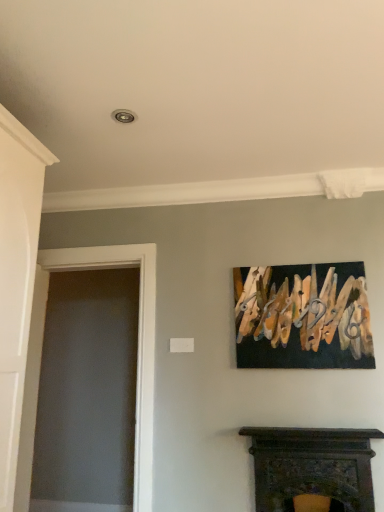
What do you see at coordinates (303, 317) in the screenshot? The height and width of the screenshot is (512, 384). I see `wooden clothespins at upper right` at bounding box center [303, 317].

Find the location of `dark wood fireplace at lower center`. dark wood fireplace at lower center is located at coordinates (312, 468).

Locate an element on the screen. Image resolution: width=384 pixels, height=512 pixels. transparent glass door at left is located at coordinates (137, 357).

Measure the distance between transparent glass door at left and camera.

They are 2.37 meters apart.

At what (x,y) coordinates should I click in order to perform the action: click on white painted wood door at left. Please return your answer as a coordinate pair (x, y). The image size is (384, 512). Looking at the image, I should click on (16, 279).

Between wooden clothespins at upper right and dark wood fireplace at lower center, which one has smaller width?

wooden clothespins at upper right is thinner.

How many degrees apart are the facing directions of wooden clothespins at upper right and dark wood fireplace at lower center?

The angular difference between wooden clothespins at upper right and dark wood fireplace at lower center is 0.000807 degrees.

Considering the relative sizes of wooden clothespins at upper right and dark wood fireplace at lower center in the image provided, is wooden clothespins at upper right taller than dark wood fireplace at lower center?

Indeed, wooden clothespins at upper right has a greater height compared to dark wood fireplace at lower center.

Is wooden clothespins at upper right not near dark wood fireplace at lower center?

wooden clothespins at upper right is actually quite close to dark wood fireplace at lower center.

Is white painted wood door at left facing away from wooden clothespins at upper right?

No, white painted wood door at left is not facing the opposite direction of wooden clothespins at upper right.

Is white painted wood door at left inside the boundaries of wooden clothespins at upper right, or outside?

white painted wood door at left cannot be found inside wooden clothespins at upper right.

Is white painted wood door at left beside wooden clothespins at upper right?

There is a gap between white painted wood door at left and wooden clothespins at upper right.

Is white painted wood door at left bigger than wooden clothespins at upper right?

Indeed, white painted wood door at left has a larger size compared to wooden clothespins at upper right.

Which of these two, transparent glass door at left or white painted wood door at left, is wider?

Wider between the two is transparent glass door at left.

From the picture: Does transparent glass door at left touch white painted wood door at left?

No, transparent glass door at left is not beside white painted wood door at left.

Is transparent glass door at left to the left or to the right of white painted wood door at left in the image?

In the image, transparent glass door at left appears on the right side of white painted wood door at left.

Who is shorter, white painted wood door at left or transparent glass door at left?

Standing shorter between the two is white painted wood door at left.

Between white painted wood door at left and transparent glass door at left, which one is positioned in front?

white painted wood door at left.

Which is closer, (24, 322) or (105, 254)?

The point (24, 322) is closer.

Can you tell me how much white painted wood door at left and transparent glass door at left differ in facing direction?

The angular difference between white painted wood door at left and transparent glass door at left is 94.6 degrees.

Locate an element on the screen. glass door on the left of dark wood fireplace at lower center is located at coordinates (137, 357).

Based on the photo, between transparent glass door at left and dark wood fireplace at lower center, which one has less height?

Standing shorter between the two is dark wood fireplace at lower center.

Is dark wood fireplace at lower center inside transparent glass door at left?

That's incorrect, dark wood fireplace at lower center is not inside transparent glass door at left.

How far apart are dark wood fireplace at lower center and transparent glass door at left?

They are 39.12 inches apart.

From a real-world perspective, relative to transparent glass door at left, is dark wood fireplace at lower center vertically above or below?

Clearly, from a real-world perspective, dark wood fireplace at lower center is below transparent glass door at left.

Is dark wood fireplace at lower center aimed at transparent glass door at left?

No, dark wood fireplace at lower center is not turned towards transparent glass door at left.

Are dark wood fireplace at lower center and transparent glass door at left beside each other?

They are not placed beside each other.

Find the location of `glass door below the wooden clothespins at upper right (from the image's perspective)`. glass door below the wooden clothespins at upper right (from the image's perspective) is located at coordinates (137, 357).

How much distance is there between transparent glass door at left and wooden clothespins at upper right?

transparent glass door at left is 37.47 inches from wooden clothespins at upper right.

Is transparent glass door at left facing away from wooden clothespins at upper right?

No, wooden clothespins at upper right is not at the back of transparent glass door at left.

Considering the positions of objects transparent glass door at left and wooden clothespins at upper right in the image provided, who is more to the left, transparent glass door at left or wooden clothespins at upper right?

transparent glass door at left is more to the left.

The image size is (384, 512). I want to click on fireplace beneath the wooden clothespins at upper right (from a real-world perspective), so click(x=312, y=468).

The height and width of the screenshot is (512, 384). I want to click on picture frame above the white painted wood door at left (from the image's perspective), so click(x=303, y=317).

Which object lies nearer to the anchor point white painted wood door at left, wooden clothespins at upper right or dark wood fireplace at lower center?

Among the two, wooden clothespins at upper right is located nearer to white painted wood door at left.

Estimate the real-world distances between objects in this image. Which object is further from transparent glass door at left, wooden clothespins at upper right or white painted wood door at left?

wooden clothespins at upper right.

Estimate the real-world distances between objects in this image. Which object is further from wooden clothespins at upper right, transparent glass door at left or dark wood fireplace at lower center?

transparent glass door at left lies further to wooden clothespins at upper right than the other object.

Which object lies nearer to the anchor point dark wood fireplace at lower center, transparent glass door at left or white painted wood door at left?

transparent glass door at left lies closer to dark wood fireplace at lower center than the other object.

Estimate the real-world distances between objects in this image. Which object is closer to transparent glass door at left, white painted wood door at left or dark wood fireplace at lower center?

white painted wood door at left is positioned closer to the anchor transparent glass door at left.

Estimate the real-world distances between objects in this image. Which object is closer to wooden clothespins at upper right, transparent glass door at left or white painted wood door at left?

transparent glass door at left.

From the image, which object appears to be nearer to white painted wood door at left, transparent glass door at left or wooden clothespins at upper right?

The object closer to white painted wood door at left is transparent glass door at left.

Based on their spatial positions, is transparent glass door at left or wooden clothespins at upper right further from dark wood fireplace at lower center?

transparent glass door at left is further to dark wood fireplace at lower center.

Where is `glass door situated between white painted wood door at left and dark wood fireplace at lower center from left to right`? glass door situated between white painted wood door at left and dark wood fireplace at lower center from left to right is located at coordinates (137, 357).

The width and height of the screenshot is (384, 512). What are the coordinates of `picture frame between transparent glass door at left and dark wood fireplace at lower center` in the screenshot? It's located at click(303, 317).

Where is `picture frame between white painted wood door at left and dark wood fireplace at lower center`? The width and height of the screenshot is (384, 512). picture frame between white painted wood door at left and dark wood fireplace at lower center is located at coordinates (303, 317).

Where is `glass door between white painted wood door at left and wooden clothespins at upper right from left to right`? The image size is (384, 512). glass door between white painted wood door at left and wooden clothespins at upper right from left to right is located at coordinates (137, 357).